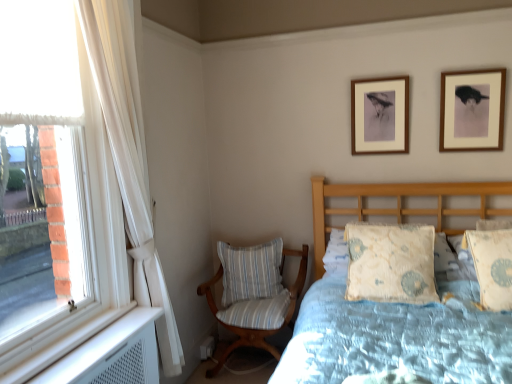
Question: Does wooden picture frame at upper center, the 2th picture frame from the front, appear on the right side of striped fabric chair at lower left?

Choices:
 (A) no
 (B) yes

Answer: (B)

Question: Is wooden picture frame at upper center, marked as the second picture frame in a right-to-left arrangement, next to striped fabric chair at lower left?

Choices:
 (A) yes
 (B) no

Answer: (B)

Question: Considering the relative sizes of wooden picture frame at upper center, the 1th picture frame in the back-to-front sequence, and striped fabric chair at lower left in the image provided, is wooden picture frame at upper center, the 1th picture frame in the back-to-front sequence, smaller than striped fabric chair at lower left?

Choices:
 (A) no
 (B) yes

Answer: (B)

Question: Is wooden picture frame at upper center, which is counted as the first picture frame, starting from the left, to the left of striped fabric chair at lower left from the viewer's perspective?

Choices:
 (A) yes
 (B) no

Answer: (B)

Question: Are wooden picture frame at upper center, the 2th picture frame from the front, and striped fabric chair at lower left located far from each other?

Choices:
 (A) no
 (B) yes

Answer: (B)

Question: Would you say wooden picture frame at upper right, which ranks as the first picture frame in front-to-back order, is to the left or to the right of light blue floral fabric pillow at right, placed as the 3th pillow when sorted from left to right, in the picture?

Choices:
 (A) right
 (B) left

Answer: (A)

Question: Does point (461, 94) appear closer or farther from the camera than point (480, 297)?

Choices:
 (A) farther
 (B) closer

Answer: (A)

Question: Relative to light blue floral fabric pillow at right, placed as the 3th pillow when sorted from left to right, is wooden picture frame at upper right, which is counted as the 2th picture frame, starting from the back, in front or behind?

Choices:
 (A) behind
 (B) front

Answer: (A)

Question: Looking at their shapes, would you say wooden picture frame at upper right, which appears as the 1th picture frame when viewed from the right, is wider or thinner than light blue floral fabric pillow at right, the first pillow from the front?

Choices:
 (A) thin
 (B) wide

Answer: (A)

Question: Would you say wooden picture frame at upper center, the 1th picture frame in the back-to-front sequence, is to the left or to the right of white sheer curtain at left in the picture?

Choices:
 (A) left
 (B) right

Answer: (B)

Question: Considering their positions, is wooden picture frame at upper center, the 2th picture frame from the front, located in front of or behind white sheer curtain at left?

Choices:
 (A) front
 (B) behind

Answer: (B)

Question: From a real-world perspective, is wooden picture frame at upper center, the 1th picture frame in the back-to-front sequence, physically located above or below white sheer curtain at left?

Choices:
 (A) below
 (B) above

Answer: (B)

Question: In terms of height, does wooden picture frame at upper center, marked as the second picture frame in a right-to-left arrangement, look taller or shorter compared to white sheer curtain at left?

Choices:
 (A) tall
 (B) short

Answer: (B)

Question: Considering their positions, is light blue floral fabric pillow at right, the 1th pillow from the right, located in front of or behind white striped cushion at center, which is the first pillow in left-to-right order?

Choices:
 (A) behind
 (B) front

Answer: (B)

Question: From the image's perspective, is light blue floral fabric pillow at right, the first pillow from the front, positioned above or below white striped cushion at center, marked as the first pillow in a back-to-front arrangement?

Choices:
 (A) below
 (B) above

Answer: (B)